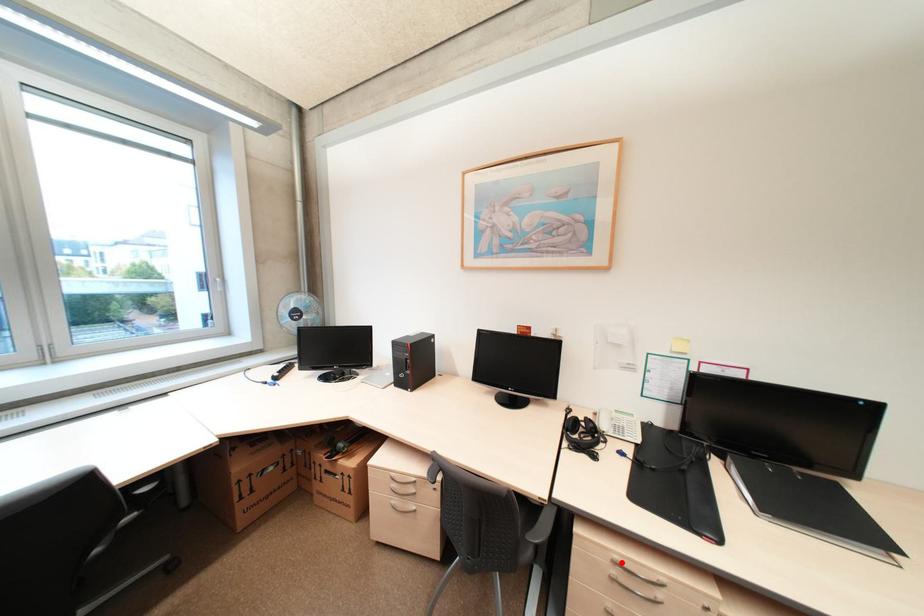
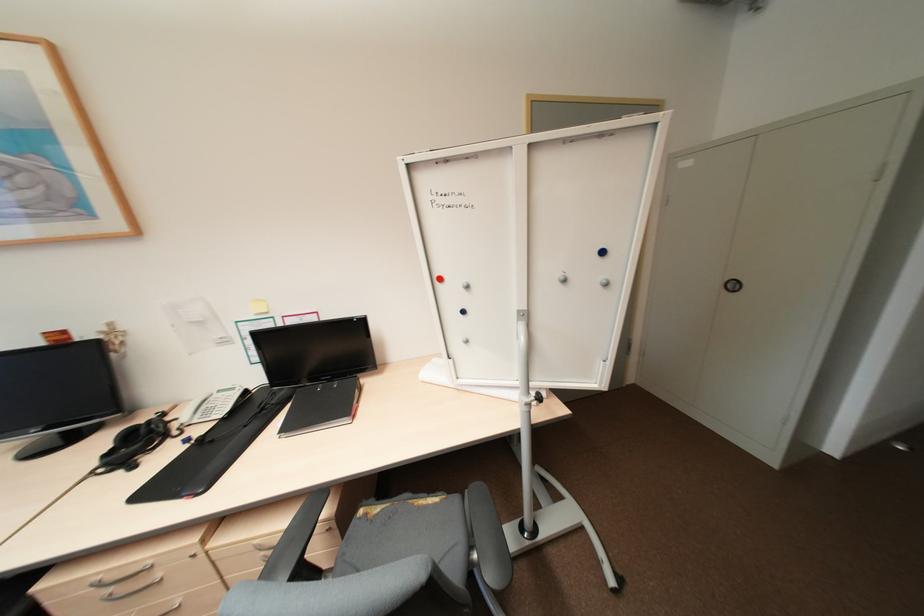
The point at the highlighted location is marked in the first image. Where is the corresponding point in the second image?

(104, 584)